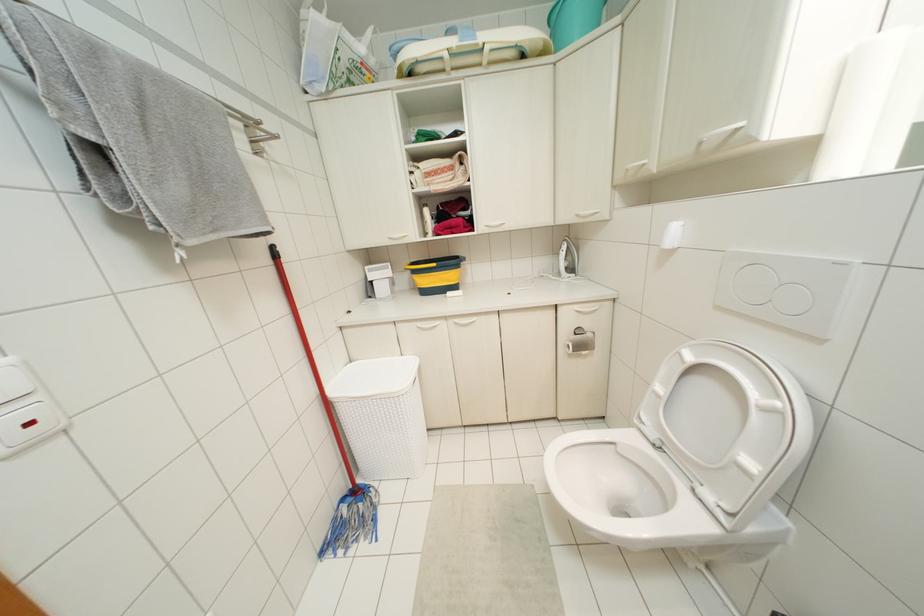
Find where to lower the white toilet lid. Please return your answer as a coordinate pair (x, y).

(719, 419)